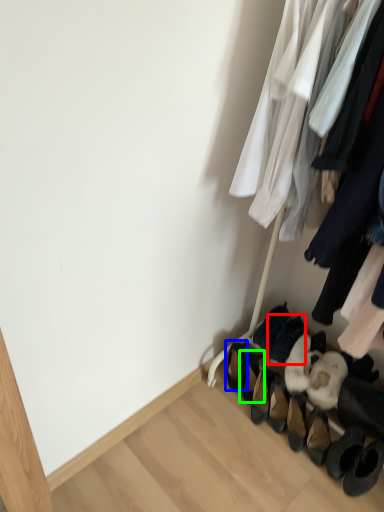
Question: Considering the real-world distances, which object is farthest from footwear (highlighted by a red box)? footwear (highlighted by a blue box) or footwear (highlighted by a green box)?

Choices:
 (A) footwear
 (B) footwear

Answer: (A)